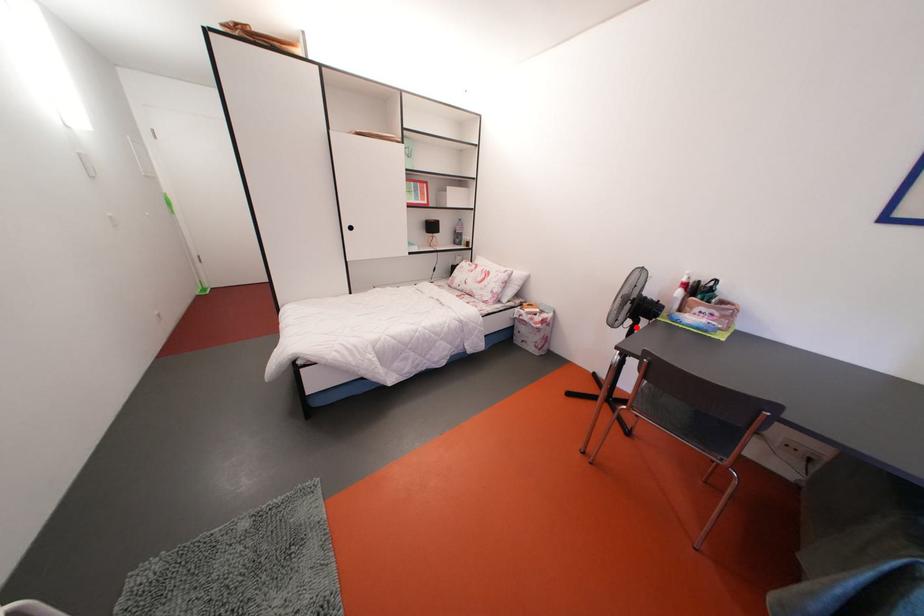
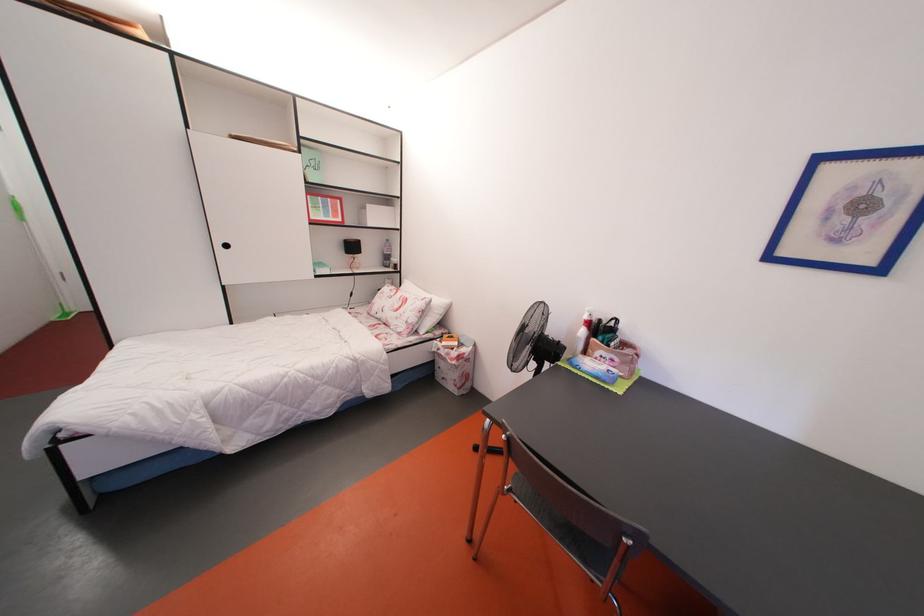
Find the pixel in the second image that matches the highlighted location in the first image.

(541, 370)